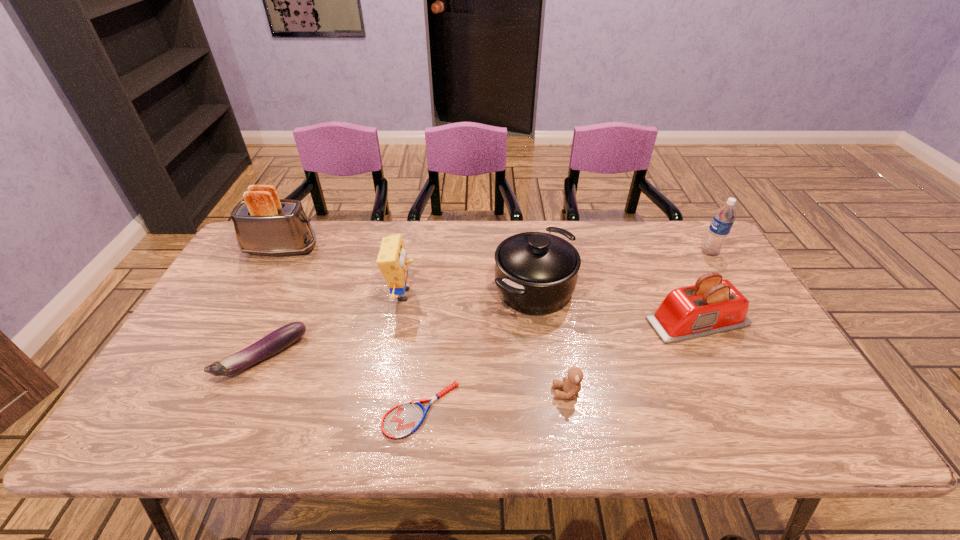
The width and height of the screenshot is (960, 540). I want to click on vacant region located 0.150m on the side of the farther toaster with the control lever, so click(365, 249).

Locate an element on the screen. This screenshot has height=540, width=960. vacant space located on the left of the water bottle is located at coordinates (658, 252).

What are the coordinates of `free space located 0.400m on the right of the saucepan` in the screenshot? It's located at (710, 289).

Identify the location of vacant space positioned on the face of the sponge. The height and width of the screenshot is (540, 960). (555, 295).

Find the location of a particular element. free location located on the back of the right toaster is located at coordinates (656, 236).

You are a GUI agent. You are given a task and a screenshot of the screen. Output one action in this format:
    pyautogui.click(x=<x>, y=<y>)
    Task: Click on the vacant region located 0.250m on the front-facing side of the teddy bear
    
    Given the screenshot: What is the action you would take?
    pyautogui.click(x=447, y=392)

The image size is (960, 540). I want to click on free spot located 0.130m on the front-facing side of the teddy bear, so click(498, 392).

Locate an element on the screen. vacant space located 0.080m on the front-facing side of the teddy bear is located at coordinates click(x=519, y=392).

Where is `free space located on the back of the eggplant`? Image resolution: width=960 pixels, height=540 pixels. free space located on the back of the eggplant is located at coordinates (287, 305).

Where is `free space located 0.110m on the left of the shortest object`? This screenshot has width=960, height=540. free space located 0.110m on the left of the shortest object is located at coordinates (336, 410).